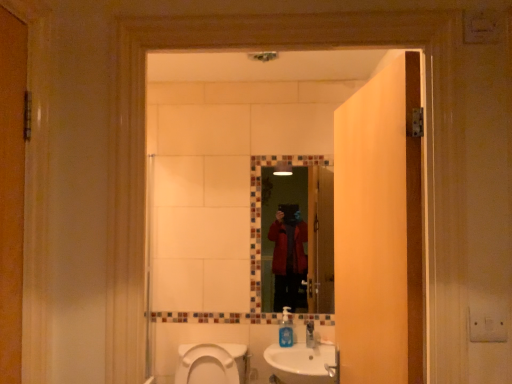
Question: Is wooden door at center closer to camera compared to glass mosaic mirror at center?

Choices:
 (A) no
 (B) yes

Answer: (B)

Question: From a real-world perspective, is wooden door at center physically below glass mosaic mirror at center?

Choices:
 (A) no
 (B) yes

Answer: (A)

Question: Considering the relative sizes of wooden door at center and glass mosaic mirror at center in the image provided, is wooden door at center wider than glass mosaic mirror at center?

Choices:
 (A) no
 (B) yes

Answer: (B)

Question: From the image's perspective, is wooden door at center above glass mosaic mirror at center?

Choices:
 (A) no
 (B) yes

Answer: (B)

Question: Considering the relative sizes of wooden door at center and glass mosaic mirror at center in the image provided, is wooden door at center smaller than glass mosaic mirror at center?

Choices:
 (A) yes
 (B) no

Answer: (B)

Question: Is wooden door at center taller than glass mosaic mirror at center?

Choices:
 (A) no
 (B) yes

Answer: (B)

Question: Is white ceramic sink at lower center oriented away from blue translucent soap dispenser at lower center?

Choices:
 (A) no
 (B) yes

Answer: (B)

Question: Does white ceramic sink at lower center have a greater height compared to blue translucent soap dispenser at lower center?

Choices:
 (A) no
 (B) yes

Answer: (B)

Question: Considering the relative positions of white ceramic sink at lower center and blue translucent soap dispenser at lower center in the image provided, is white ceramic sink at lower center in front of blue translucent soap dispenser at lower center?

Choices:
 (A) yes
 (B) no

Answer: (A)

Question: Is white ceramic sink at lower center completely or partially outside of blue translucent soap dispenser at lower center?

Choices:
 (A) yes
 (B) no

Answer: (A)

Question: Is blue translucent soap dispenser at lower center completely or partially inside white ceramic sink at lower center?

Choices:
 (A) yes
 (B) no

Answer: (A)

Question: Is white ceramic sink at lower center facing towards blue translucent soap dispenser at lower center?

Choices:
 (A) no
 (B) yes

Answer: (A)

Question: Does blue translucent soap dispenser at lower center turn towards glass mosaic mirror at center?

Choices:
 (A) yes
 (B) no

Answer: (B)